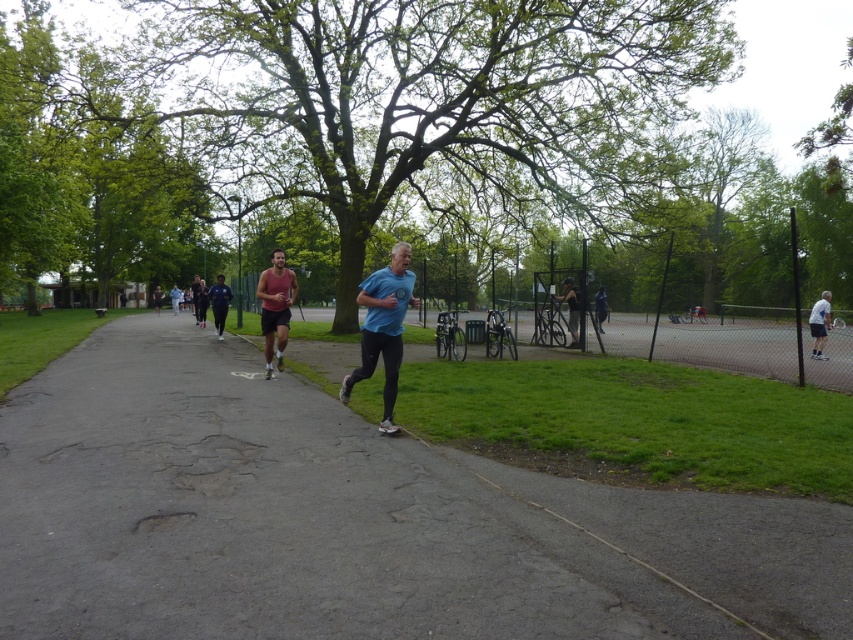
Is point (51, 182) closer to viewer compared to point (264, 291)?

No, (51, 182) is further to viewer.

Is point (33, 268) farther from viewer compared to point (264, 348)?

Yes, point (33, 268) is behind point (264, 348).

You are a GUI agent. You are given a task and a screenshot of the screen. Output one action in this format:
    pyautogui.click(x=<x>, y=<y>)
    Task: Click on the green leafy tree at upper left
    The height and width of the screenshot is (640, 853).
    Given the screenshot: What is the action you would take?
    pyautogui.click(x=80, y=177)

In order to click on green leafy tree at upper left in this screenshot , I will do `click(80, 177)`.

Between green leafy tree at center and white matte tennis racket at right, which one has less height?

white matte tennis racket at right

Which is behind, point (425, 19) or point (827, 296)?

The point (425, 19) is more distant.

At what (x,y) coordinates should I click in order to perform the action: click on green leafy tree at center. Please return your answer as a coordinate pair (x, y). Looking at the image, I should click on (428, 97).

Is dark blue fabric pants at left shorter than dark blue jersey at center?

No.

Which of these two, dark blue fabric pants at left or dark blue jersey at center, stands shorter?

dark blue jersey at center is shorter.

Where is `dark blue fabric pants at left`? The height and width of the screenshot is (640, 853). dark blue fabric pants at left is located at coordinates click(x=219, y=304).